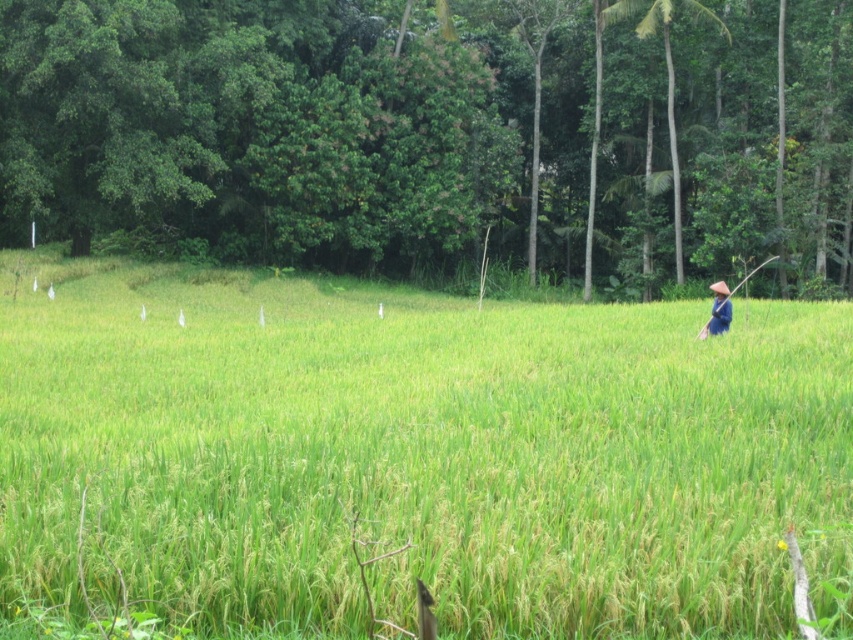
You are a farmer who wants to check the height of the crops in your field. You see the green grassy field at center and the brown straw hat at right. Which object is taller?

The green grassy field at center is taller than the brown straw hat at right.

You are a farmer standing in the rice paddy field. You notice a green grassy field at center and a brown straw hat at right. Which object is positioned to the left of the other?

The green grassy field at center is to the left of the brown straw hat at right.